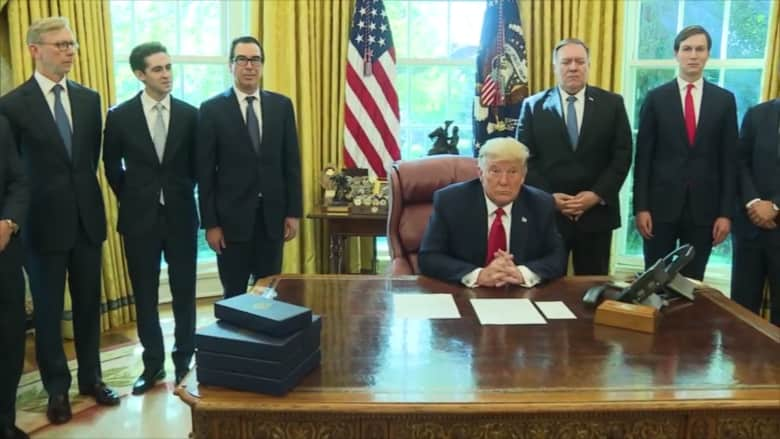
The height and width of the screenshot is (439, 780). I want to click on desk, so click(x=491, y=430).